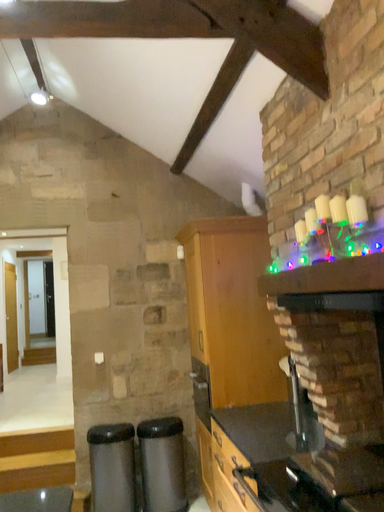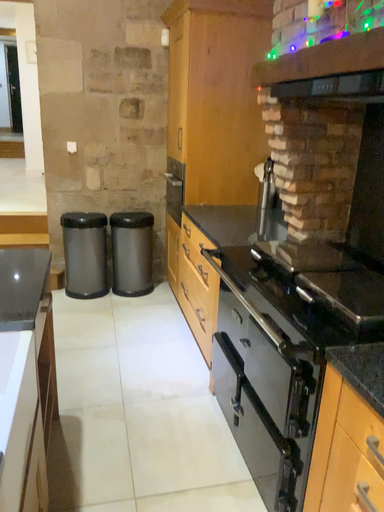
Question: How did the camera likely rotate when shooting the video?

Choices:
 (A) rotated downward
 (B) rotated upward

Answer: (A)